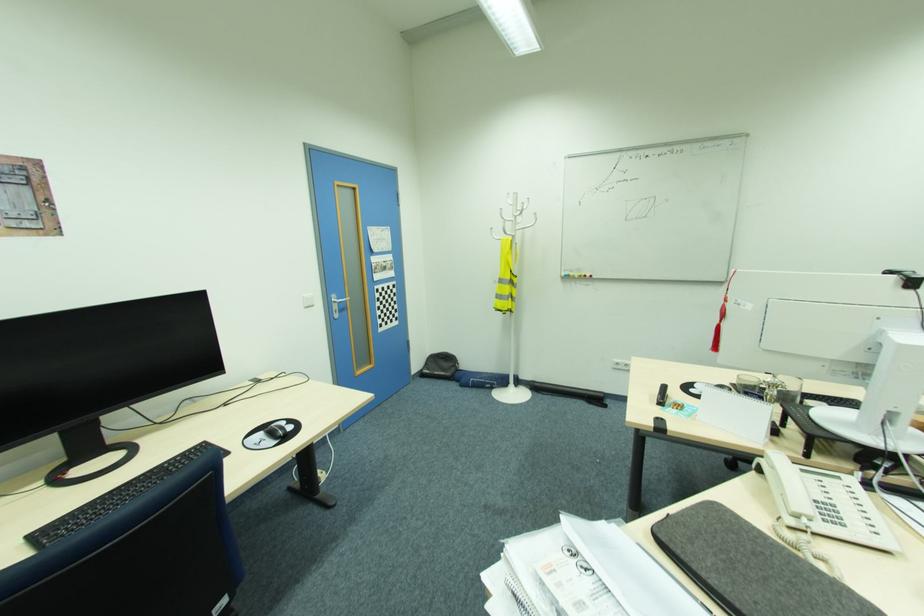
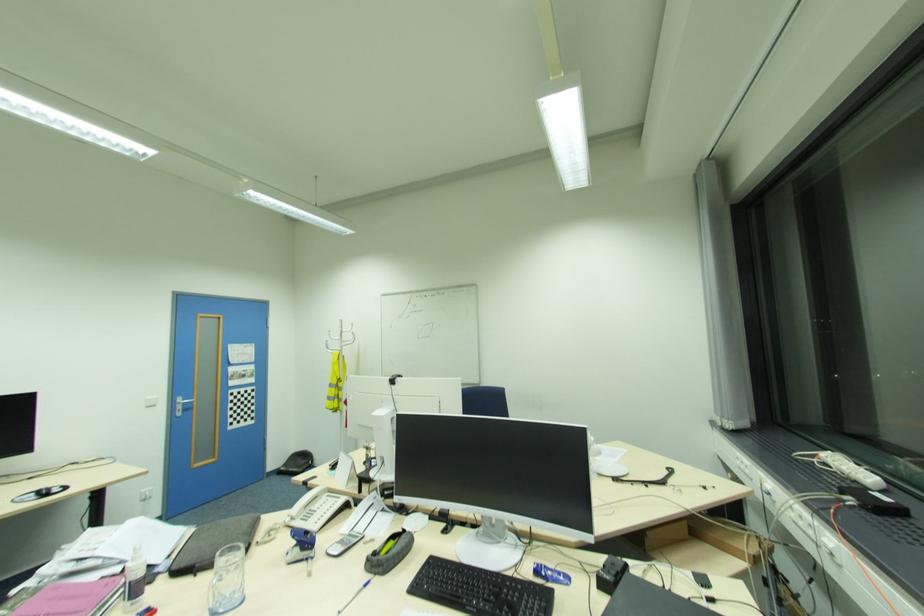
In a continuous first-person perspective shot, in which direction is the camera moving?

The movement direction of the cameraman is right, backward.